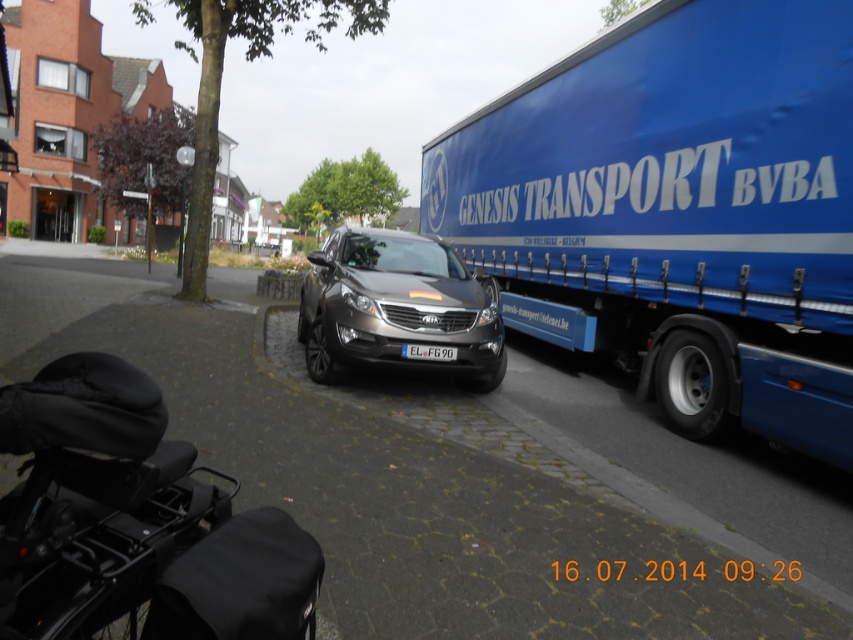
You are a delivery driver who needs to park your 2.5 meter wide vehicle between the blue matte truck at right and the silver Kia car parked on the side of the road. Can you safely park your vehicle there without overlapping either vehicle?

The blue matte truck at right is 3.77 meters from the camera. Since the distance between the blue matte truck at right and the silver Kia car is not provided, we cannot determine if there is enough space to park the 2.5 meter wide vehicle safely without overlapping either vehicle.

You are a delivery person trying to park your van between the satin black car at center and the white plastic license plate at center. Can you estimate whether there is enough space between them for your van, given that your van is 2 meters wide?

The satin black car at center is wider than the white plastic license plate at center. Since the van is 2 meters wide, the space between them may be sufficient if the distance between the two objects is at least 2 meters. However, without exact measurements of the gap, it is difficult to confirm definitively.